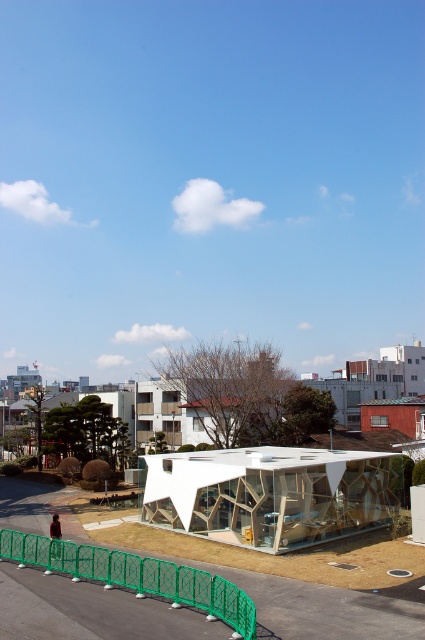
Question: Which point appears closest to the camera in this image?

Choices:
 (A) (277, 454)
 (B) (197, 573)

Answer: (B)

Question: Can you confirm if transparent glass shelter at center is bigger than green plastic fence at lower center?

Choices:
 (A) yes
 (B) no

Answer: (A)

Question: Is transparent glass shelter at center below green plastic fence at lower center?

Choices:
 (A) yes
 (B) no

Answer: (A)

Question: Where is transparent glass shelter at center located in relation to green plastic fence at lower center in the image?

Choices:
 (A) above
 (B) below

Answer: (B)